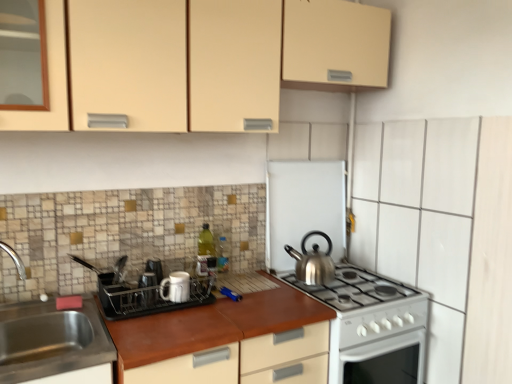
Question: Is white matte dish rack at center, which appears as the first appliance when viewed from the front, in front of silver metallic kettle at center-right?

Choices:
 (A) no
 (B) yes

Answer: (B)

Question: Is white matte dish rack at center, the 1th appliance from the left, outside of silver metallic kettle at center-right?

Choices:
 (A) no
 (B) yes

Answer: (B)

Question: Is the depth of white matte dish rack at center, the third appliance in the right-to-left sequence, greater than that of silver metallic kettle at center-right?

Choices:
 (A) no
 (B) yes

Answer: (A)

Question: Could you tell me if white matte dish rack at center, which appears as the first appliance when viewed from the front, is facing silver metallic kettle at center-right?

Choices:
 (A) no
 (B) yes

Answer: (A)

Question: Considering the relative positions of white matte dish rack at center, the third appliance in the right-to-left sequence, and silver metallic kettle at center-right in the image provided, is white matte dish rack at center, the third appliance in the right-to-left sequence, to the left of silver metallic kettle at center-right from the viewer's perspective?

Choices:
 (A) no
 (B) yes

Answer: (B)

Question: Relative to silver metallic kettle at center-right, is white ceramic mug at center, the 2th appliance positioned from the right, in front or behind?

Choices:
 (A) front
 (B) behind

Answer: (A)

Question: Based on their sizes in the image, would you say white ceramic mug at center, arranged as the 2th appliance when viewed from the back, is bigger or smaller than silver metallic kettle at center-right?

Choices:
 (A) big
 (B) small

Answer: (B)

Question: Is white ceramic mug at center, acting as the 2th appliance starting from the front, situated inside silver metallic kettle at center-right or outside?

Choices:
 (A) outside
 (B) inside

Answer: (A)

Question: Is point (187, 279) closer or farther from the camera than point (297, 268)?

Choices:
 (A) farther
 (B) closer

Answer: (B)

Question: Which is correct: white matte dish rack at center, which appears as the first appliance when viewed from the front, is inside satin silver kettle at center, marked as the third appliance in a front-to-back arrangement, or outside of it?

Choices:
 (A) inside
 (B) outside

Answer: (B)

Question: Relative to satin silver kettle at center, arranged as the 1th appliance when viewed from the right, is white matte dish rack at center, which appears as the first appliance when viewed from the front, in front or behind?

Choices:
 (A) behind
 (B) front

Answer: (B)

Question: Considering the positions of white matte dish rack at center, the 1th appliance from the left, and satin silver kettle at center, marked as the third appliance in a front-to-back arrangement, in the image, is white matte dish rack at center, the 1th appliance from the left, wider or thinner than satin silver kettle at center, marked as the third appliance in a front-to-back arrangement,?

Choices:
 (A) thin
 (B) wide

Answer: (B)

Question: From the image's perspective, is white matte dish rack at center, the third appliance in the right-to-left sequence, located above or below satin silver kettle at center, marked as the third appliance in a front-to-back arrangement?

Choices:
 (A) below
 (B) above

Answer: (A)

Question: Based on their sizes in the image, would you say white matte dish rack at center, the third appliance in the right-to-left sequence, is bigger or smaller than matte beige cabinet at upper center?

Choices:
 (A) big
 (B) small

Answer: (B)

Question: Looking at their shapes, would you say white matte dish rack at center, the third appliance in the right-to-left sequence, is wider or thinner than matte beige cabinet at upper center?

Choices:
 (A) wide
 (B) thin

Answer: (A)